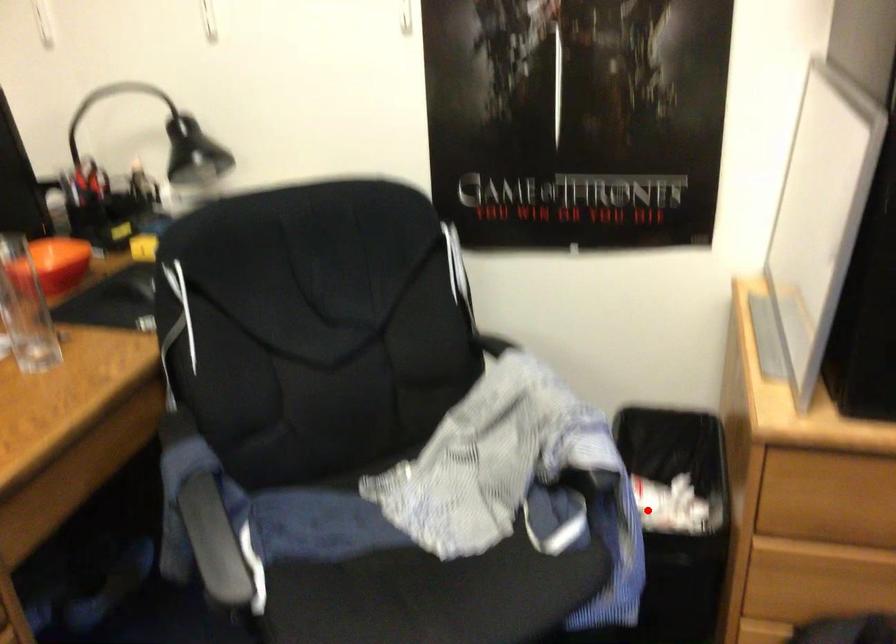
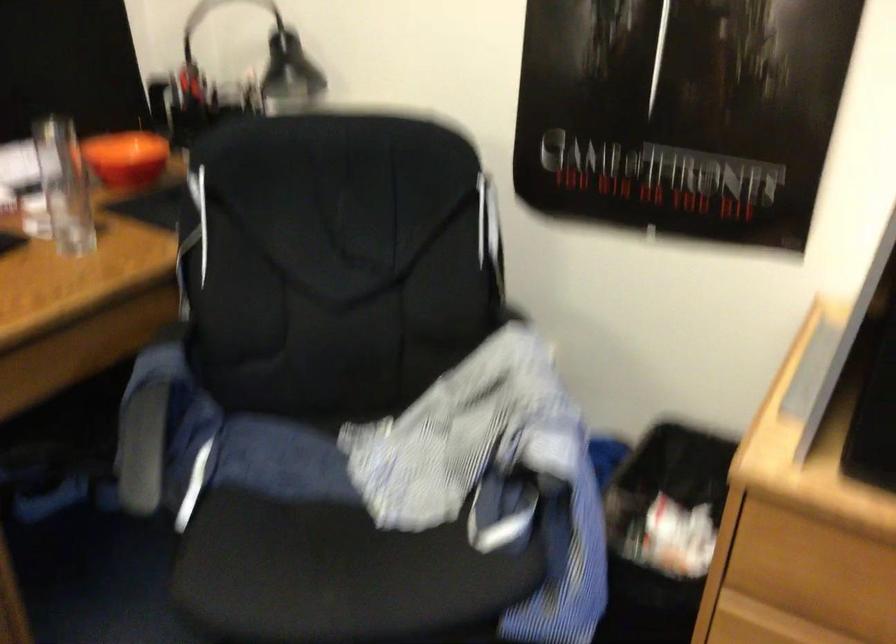
Where in the second image is the point corresponding to the highlighted location from the first image?

(659, 529)